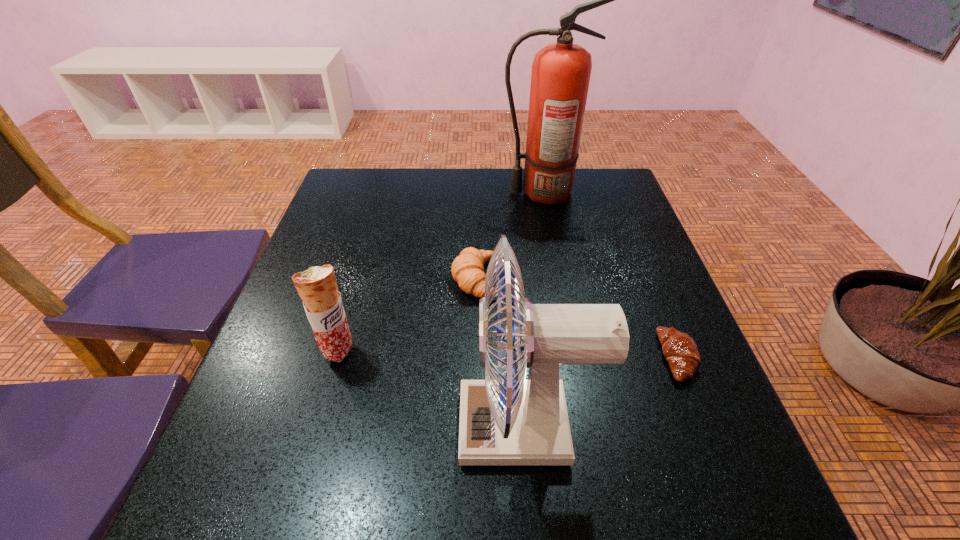
This screenshot has width=960, height=540. In order to click on free point that satisfies the following two spatial constraints: 1. on the nozzle of the tallest object; 2. on the front side of the farther crescent roll in this screenshot , I will do `click(558, 279)`.

Where is `free location that satisfies the following two spatial constraints: 1. on the nozzle of the fire extinguisher; 2. on the front side of the leftmost object`? free location that satisfies the following two spatial constraints: 1. on the nozzle of the fire extinguisher; 2. on the front side of the leftmost object is located at coordinates (571, 351).

Where is `vacant position in the image that satisfies the following two spatial constraints: 1. on the back side of the taller crescent roll; 2. on the right side of the burrito`? The height and width of the screenshot is (540, 960). vacant position in the image that satisfies the following two spatial constraints: 1. on the back side of the taller crescent roll; 2. on the right side of the burrito is located at coordinates (360, 279).

This screenshot has width=960, height=540. I want to click on vacant space that satisfies the following two spatial constraints: 1. on the back side of the rightmost object; 2. on the nozzle of the farthest object, so click(612, 192).